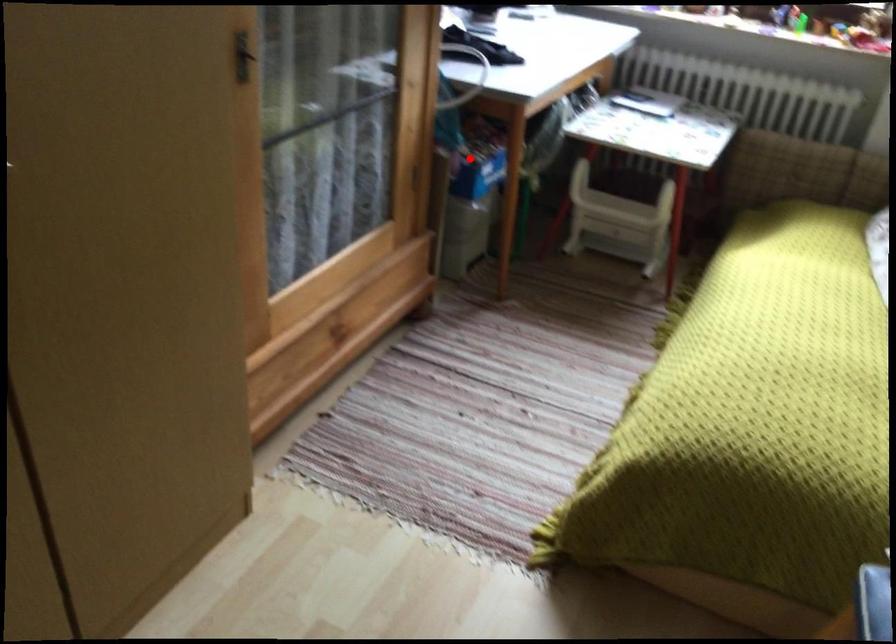
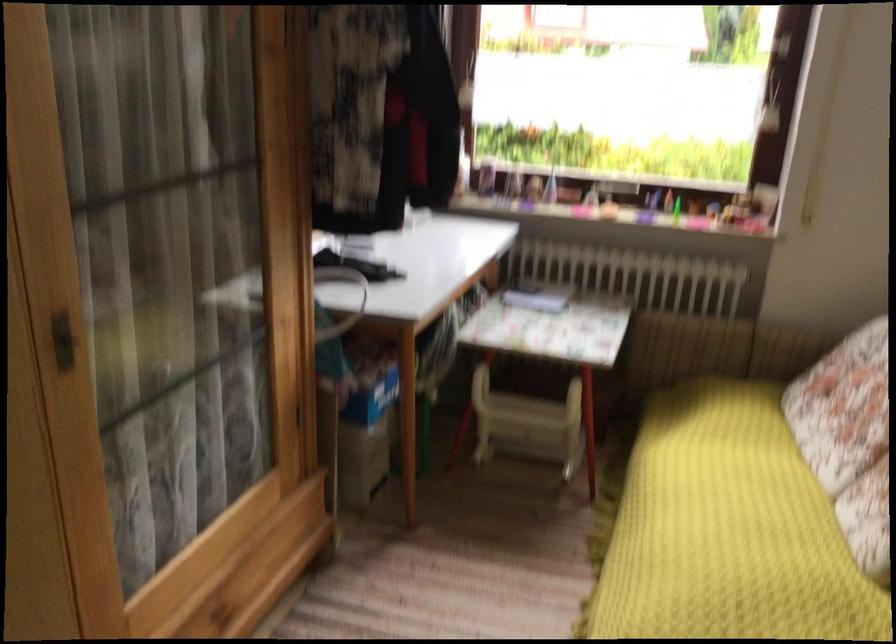
Question: I am providing you with two images of the same scene from different viewpoints. Image1 has a red point marked. In image2, the corresponding 3D location appears at what relative position? Reply with the corresponding letter.

Choices:
 (A) Closer
 (B) Farther

Answer: (A)